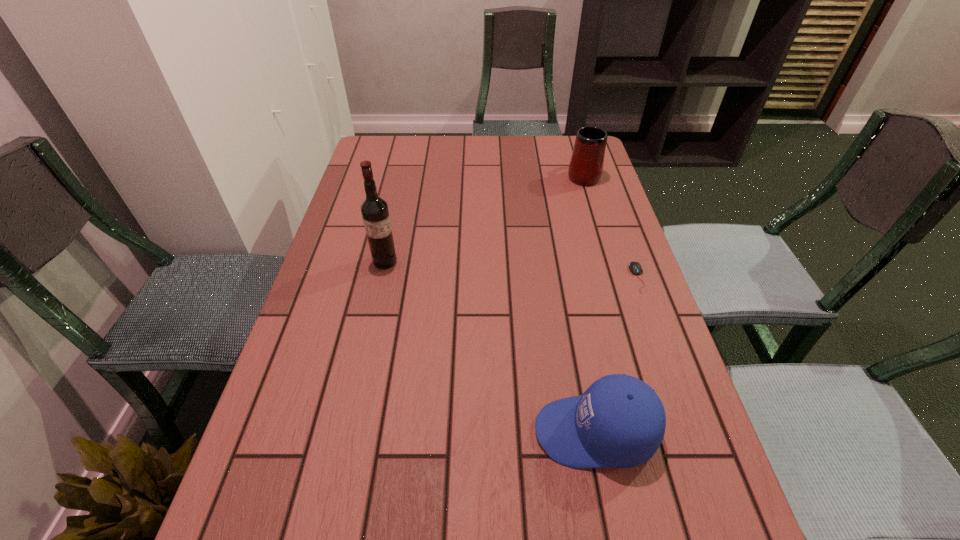
Where is `vacant point located 0.080m on the side of the mug with the handle`? vacant point located 0.080m on the side of the mug with the handle is located at coordinates (576, 151).

Identify the location of free space located 0.310m on the front-facing side of the third tallest object. (369, 432).

This screenshot has width=960, height=540. Find the location of `vacant space located on the front-facing side of the third tallest object`. vacant space located on the front-facing side of the third tallest object is located at coordinates (444, 432).

This screenshot has width=960, height=540. In order to click on vacant space situated 0.320m on the front-facing side of the third tallest object in this screenshot , I will do `click(364, 432)`.

Find the location of a particular element. The image size is (960, 540). free space located 0.300m on the front of the mouse is located at coordinates (684, 407).

Identify the location of object that is positioned at the far edge. This screenshot has width=960, height=540. (586, 165).

This screenshot has width=960, height=540. I want to click on object positioned at the left edge, so click(374, 210).

Locate an element on the screen. This screenshot has height=540, width=960. mug positioned at the right edge is located at coordinates (586, 165).

Where is `cap at the right edge`? This screenshot has height=540, width=960. cap at the right edge is located at coordinates (619, 422).

I want to click on mouse that is at the right edge, so click(x=635, y=267).